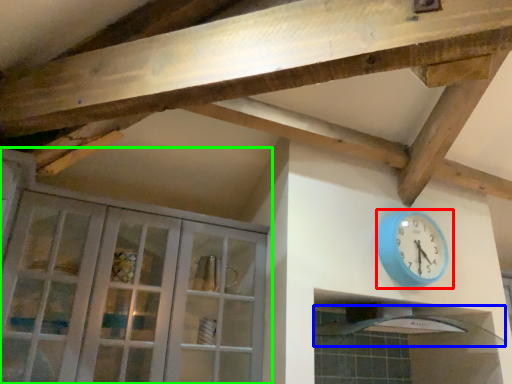
Question: Which is nearer to the wall clock (highlighted by a red box)? exhaust hood (highlighted by a blue box) or cabinetry (highlighted by a green box).

Choices:
 (A) exhaust hood
 (B) cabinetry

Answer: (A)